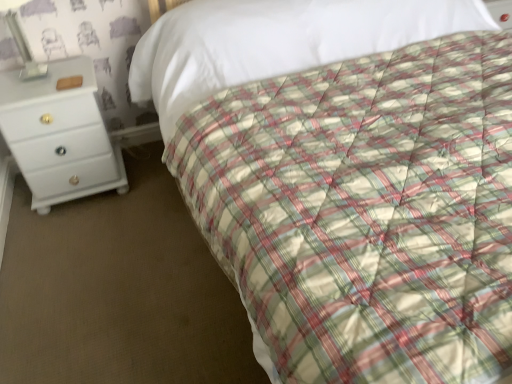
Question: In the image, is white glossy chest of drawers at left positioned in front of or behind metallic silver lamp at upper left?

Choices:
 (A) front
 (B) behind

Answer: (B)

Question: Is point (68, 140) positioned closer to the camera than point (32, 62)?

Choices:
 (A) farther
 (B) closer

Answer: (B)

Question: Looking at their shapes, would you say white glossy chest of drawers at left is wider or thinner than metallic silver lamp at upper left?

Choices:
 (A) wide
 (B) thin

Answer: (A)

Question: From the image's perspective, is metallic silver lamp at upper left positioned above or below white glossy chest of drawers at left?

Choices:
 (A) above
 (B) below

Answer: (A)

Question: Is metallic silver lamp at upper left taller or shorter than white glossy chest of drawers at left?

Choices:
 (A) tall
 (B) short

Answer: (B)

Question: Considering the relative positions of metallic silver lamp at upper left and white glossy chest of drawers at left in the image provided, is metallic silver lamp at upper left to the left or to the right of white glossy chest of drawers at left?

Choices:
 (A) right
 (B) left

Answer: (B)

Question: Based on their sizes in the image, would you say metallic silver lamp at upper left is bigger or smaller than white glossy chest of drawers at left?

Choices:
 (A) small
 (B) big

Answer: (A)